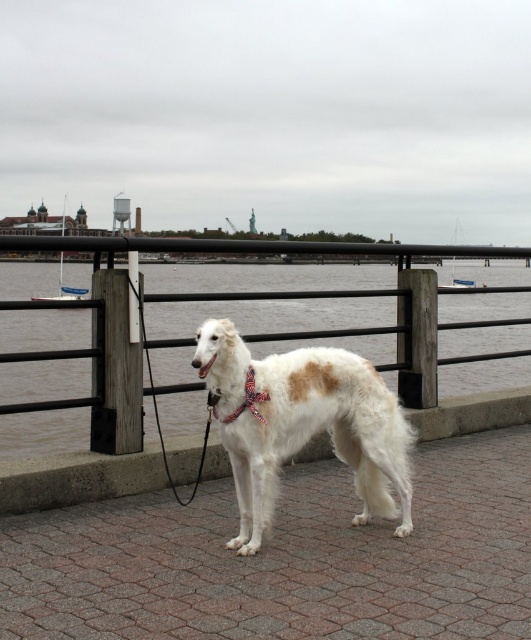
Is white water at center below black metal railing at center?

No, white water at center is not below black metal railing at center.

Between white water at center and black metal railing at center, which one appears on the right side from the viewer's perspective?

black metal railing at center is more to the right.

Which is behind, point (483, 372) or point (273, 252)?

The point (483, 372) is behind.

The width and height of the screenshot is (531, 640). I want to click on white water at center, so click(x=275, y=314).

Image resolution: width=531 pixels, height=640 pixels. In order to click on white brick pavement at center in this screenshot , I will do `click(286, 557)`.

Does white brick pavement at center have a greater height compared to red satin bow tie at center?

Incorrect, white brick pavement at center's height is not larger of red satin bow tie at center's.

Which is in front, point (494, 593) or point (235, 413)?

Point (494, 593) is more forward.

I want to click on white brick pavement at center, so click(x=286, y=557).

Who is positioned more to the left, white brick pavement at center or black metal railing at center?

white brick pavement at center is more to the left.

Does white brick pavement at center have a smaller size compared to black metal railing at center?

Correct, white brick pavement at center occupies less space than black metal railing at center.

Which is in front, point (84, 605) or point (431, 244)?

Point (84, 605) is in front.

Where is `white brick pavement at center`? white brick pavement at center is located at coordinates (286, 557).